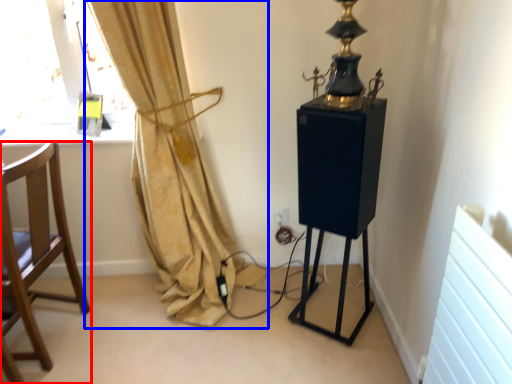
Question: Which of the following is the farthest to the observer, chair (highlighted by a red box) or curtain (highlighted by a blue box)?

Choices:
 (A) chair
 (B) curtain

Answer: (A)